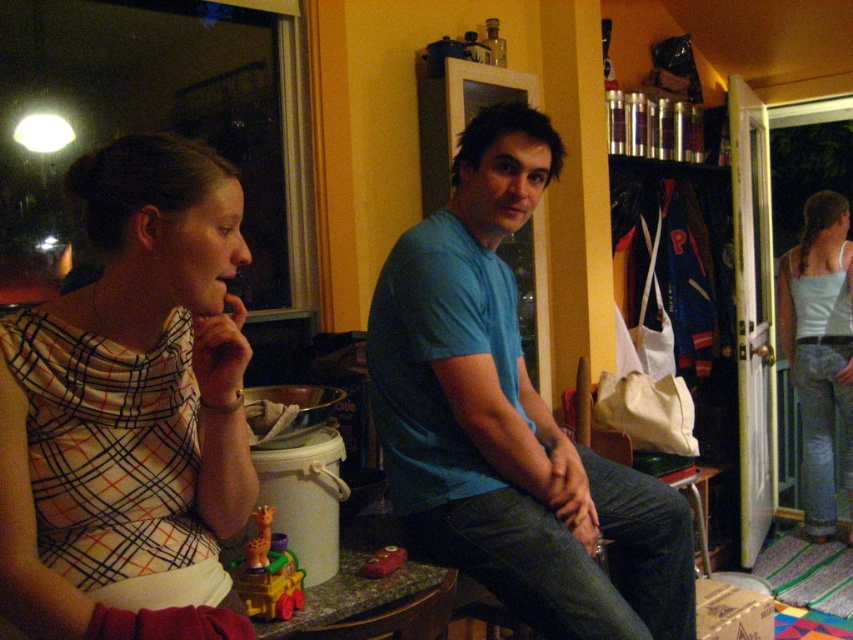
You are a photographer setting up a shoot in the living room. You need to ensure that the blue cotton shirt at center and the light blue tank top at right are visible in the frame. Based on their positions, which clothing item is covering part of the other?

The blue cotton shirt at center is positioned over the light blue tank top at right, so it is covering part of it.

You are standing in the living room and want to know where the plaid fabric dress at left is located. Can you describe its position using coordinates?

The plaid fabric dress at left is located at coordinates point (131, 410).